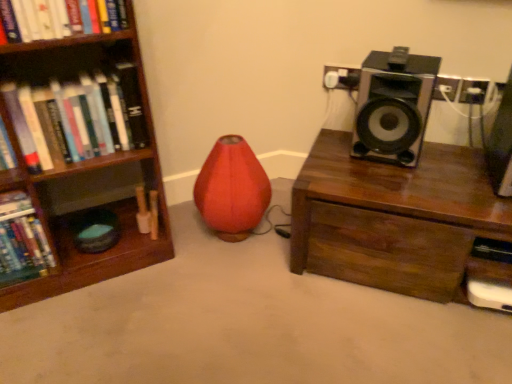
What are the coordinates of `vacant area to the left of brown wooden chest at right` in the screenshot? It's located at (250, 291).